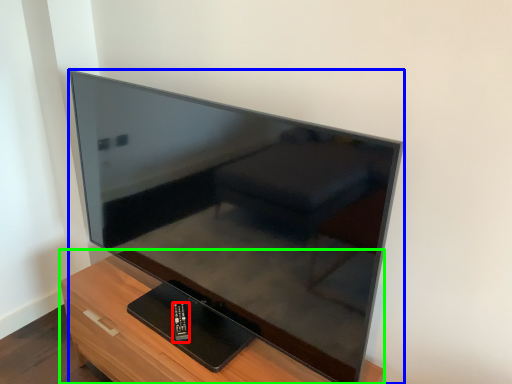
Question: Which object is positioned farthest from control (highlighted by a red box)? Select from television (highlighted by a blue box) and furniture (highlighted by a green box).

Choices:
 (A) television
 (B) furniture

Answer: (A)